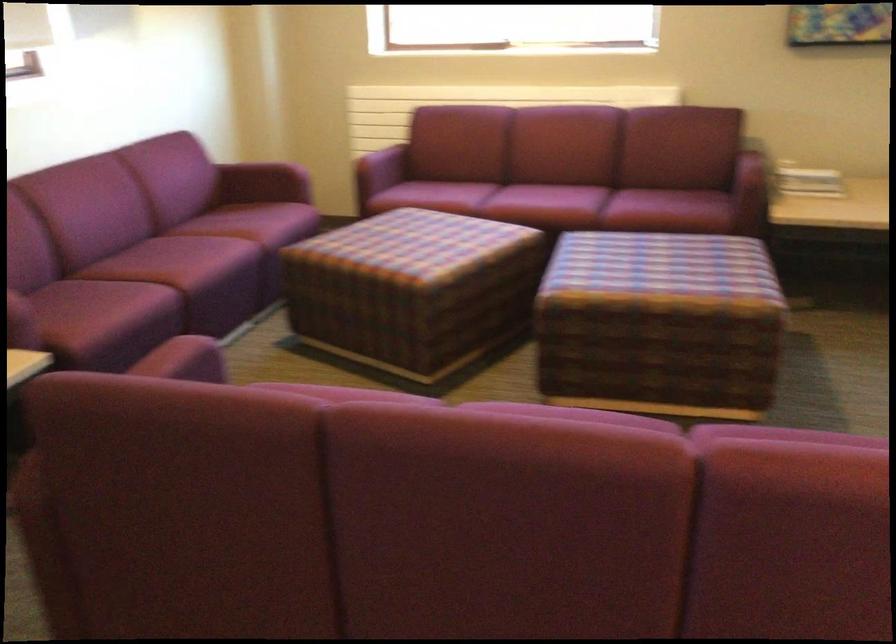
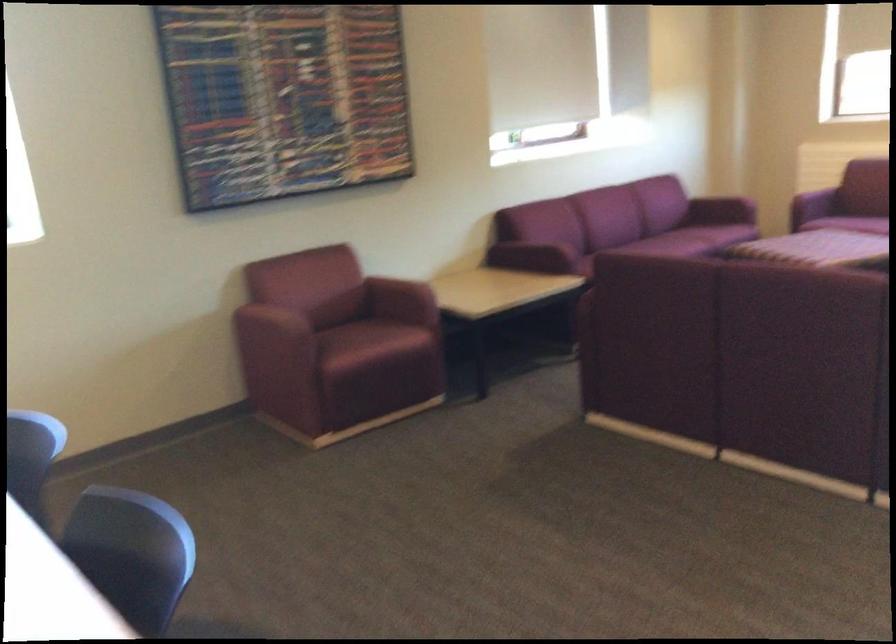
Question: I am providing you with two images of the same scene from different viewpoints. Please identify which objects are invisible in image2.

Choices:
 (A) black tissue box
 (B) plaid ottoman
 (C) maroon sofa sitting surface
 (D) maroon chair sitting surface

Answer: (B)